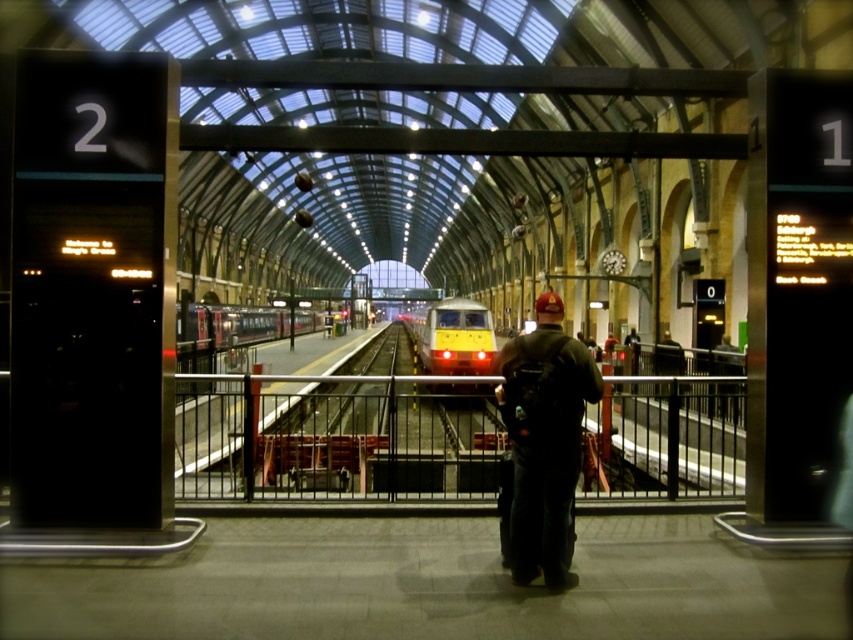
Question: Which of these objects is positioned farthest from the silver metallic train at center?

Choices:
 (A) metallic rail at center
 (B) dark blue jeans at center

Answer: (B)

Question: Does yellow metallic train at center appear under silver metallic train at center?

Choices:
 (A) no
 (B) yes

Answer: (B)

Question: Which point is closer to the camera taking this photo?

Choices:
 (A) (645, 465)
 (B) (543, 444)
 (C) (276, 308)
 (D) (428, 342)

Answer: (B)

Question: Can you confirm if metallic rail at center is thinner than yellow metallic train at center?

Choices:
 (A) no
 (B) yes

Answer: (A)

Question: Among these objects, which one is farthest from the camera?

Choices:
 (A) silver metallic train at center
 (B) metallic rail at center

Answer: (A)

Question: Is dark blue jeans at center to the left of silver metallic train at center from the viewer's perspective?

Choices:
 (A) yes
 (B) no

Answer: (B)